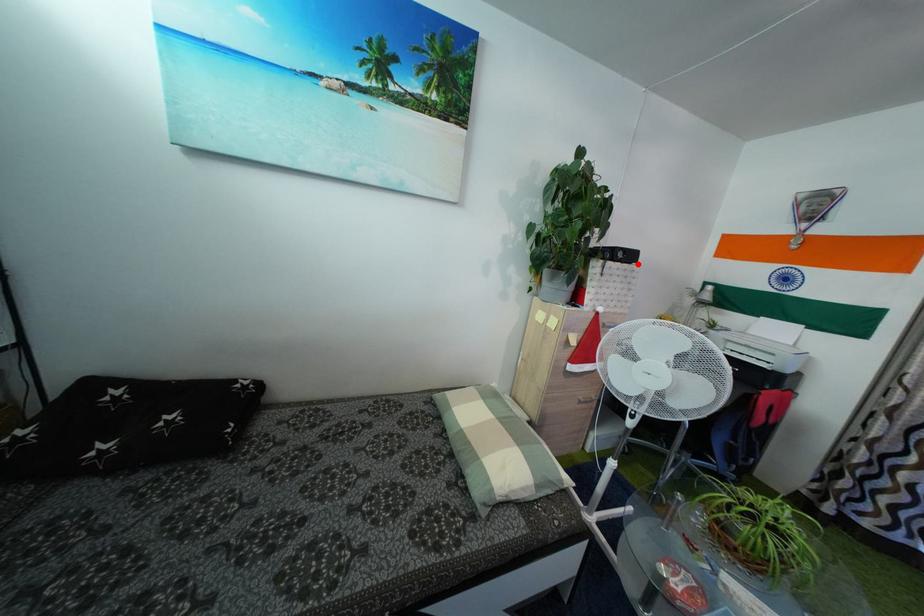
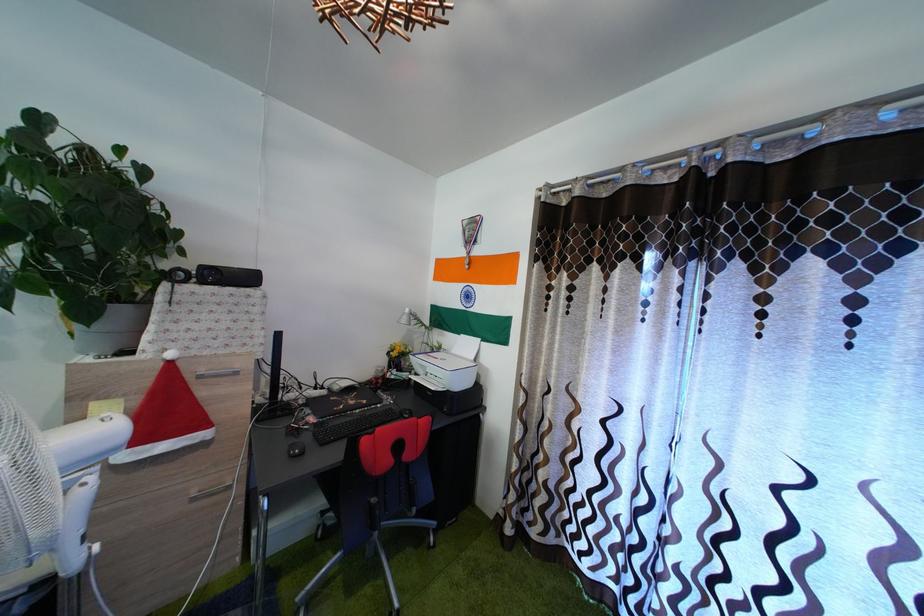
The point at the highlighted location is marked in the first image. Where is the corresponding point in the second image?

(257, 286)